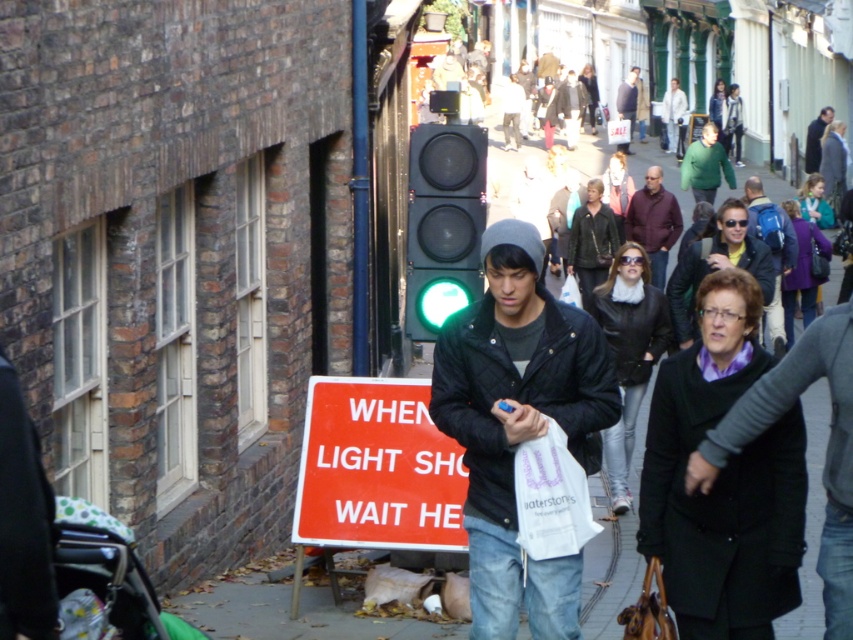
You are a fashion designer observing a street scene. You notice two people wearing the maroon wool sweater at center and the dark blue jacket at center. Which clothing item has a larger width?

The maroon wool sweater at center has a larger width than the dark blue jacket at center according to the description.

You are a fashion designer observing a street scene and notice two people wearing coats. The first person is wearing a green fuzzy sweater at center, and the second is wearing a dark blue jacket at center. Based on their positions, which coat would you say is closer to the left side of the frame?

The green fuzzy sweater at center is positioned on the left side of the dark blue jacket at center, so the green fuzzy sweater at center is closer to the left side of the frame.

Based on the scene description, can you determine which object is taller between the black quilted jacket at center and the red plastic sign at lower center?

The black quilted jacket at center is much taller than the red plastic sign at lower center.